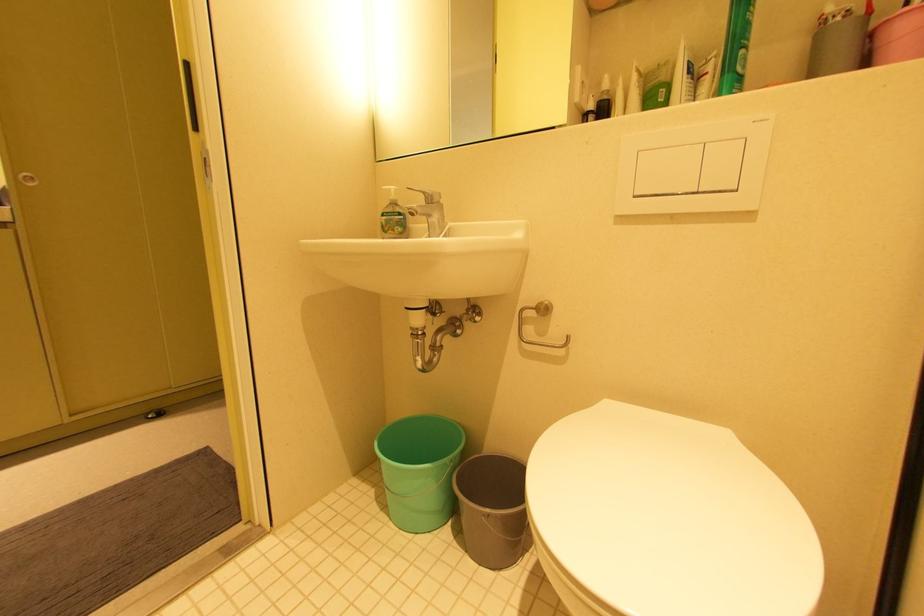
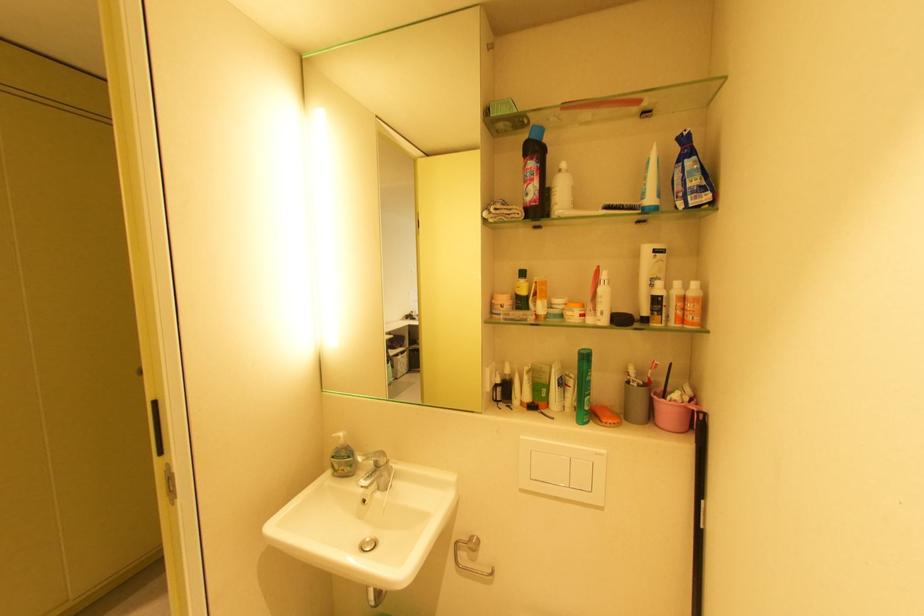
Find the pixel in the second image that matches [721,78] in the first image.

(580, 392)